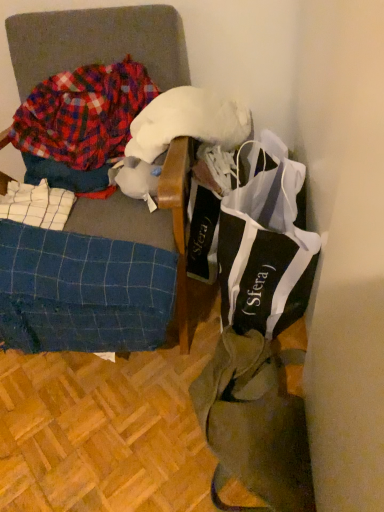
Question: Is olive green canvas tote bag at lower right beside plaid flannel shirt at left?

Choices:
 (A) yes
 (B) no

Answer: (B)

Question: Is olive green canvas tote bag at lower right positioned with its back to plaid flannel shirt at left?

Choices:
 (A) yes
 (B) no

Answer: (B)

Question: Is the depth of olive green canvas tote bag at lower right greater than that of plaid flannel shirt at left?

Choices:
 (A) no
 (B) yes

Answer: (A)

Question: Could plaid flannel shirt at left be considered to be inside olive green canvas tote bag at lower right?

Choices:
 (A) yes
 (B) no

Answer: (B)

Question: Can you confirm if olive green canvas tote bag at lower right is thinner than plaid flannel shirt at left?

Choices:
 (A) no
 (B) yes

Answer: (A)

Question: Is white fluffy wool at upper center taller or shorter than black and white fabric bag at right?

Choices:
 (A) tall
 (B) short

Answer: (B)

Question: From the image's perspective, is white fluffy wool at upper center positioned above or below black and white fabric bag at right?

Choices:
 (A) above
 (B) below

Answer: (A)

Question: Is white fluffy wool at upper center inside the boundaries of black and white fabric bag at right, or outside?

Choices:
 (A) outside
 (B) inside

Answer: (A)

Question: In terms of width, does white fluffy wool at upper center look wider or thinner when compared to black and white fabric bag at right?

Choices:
 (A) thin
 (B) wide

Answer: (A)

Question: Considering the positions of plaid flannel shirt at left and blue checkered fabric at lower left in the image, is plaid flannel shirt at left taller or shorter than blue checkered fabric at lower left?

Choices:
 (A) short
 (B) tall

Answer: (A)

Question: Is plaid flannel shirt at left in front of or behind blue checkered fabric at lower left in the image?

Choices:
 (A) behind
 (B) front

Answer: (A)

Question: Considering the relative positions of plaid flannel shirt at left and blue checkered fabric at lower left in the image provided, is plaid flannel shirt at left to the left or to the right of blue checkered fabric at lower left?

Choices:
 (A) right
 (B) left

Answer: (B)

Question: Is point (125, 69) closer or farther from the camera than point (94, 239)?

Choices:
 (A) closer
 (B) farther

Answer: (B)

Question: Looking at their shapes, would you say plaid flannel shirt at left is wider or thinner than blue plaid fabric at left?

Choices:
 (A) thin
 (B) wide

Answer: (A)

Question: Based on their positions, is plaid flannel shirt at left located to the left or right of blue plaid fabric at left?

Choices:
 (A) left
 (B) right

Answer: (A)